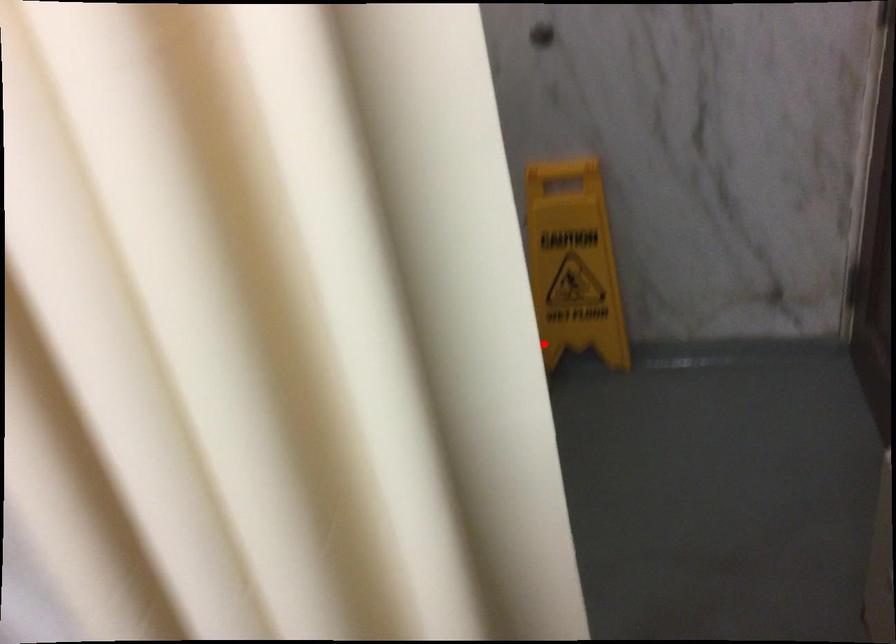
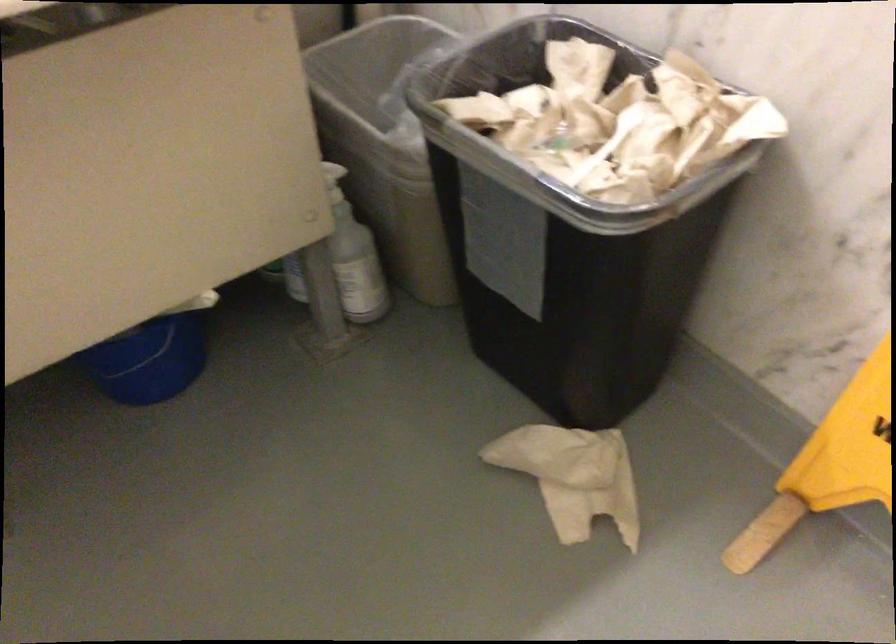
Find the pixel in the second image that matches the highlighted location in the first image.

(830, 464)